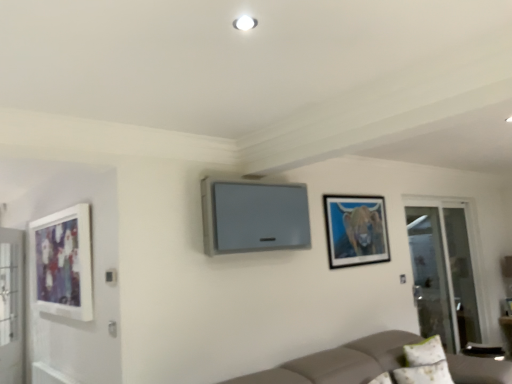
This screenshot has width=512, height=384. What do you see at coordinates (443, 273) in the screenshot?
I see `transparent glass screen door at right, the 1th screen door in the right-to-left sequence` at bounding box center [443, 273].

In the scene shown: Measure the distance between point (441,349) and camera.

The distance of point (441,349) from camera is 11.40 feet.

What do you see at coordinates (63, 263) in the screenshot? The width and height of the screenshot is (512, 384). I see `matte white picture frame at left, which is the 1th picture frame in left-to-right order` at bounding box center [63, 263].

Identify the location of matte white picture frame at left, the 2th picture frame when ordered from right to left. This screenshot has width=512, height=384. (63, 263).

The height and width of the screenshot is (384, 512). Describe the element at coordinates (11, 306) in the screenshot. I see `clear glass screen door at left, the first screen door viewed from the left` at that location.

Locate an element on the screen. matte black picture frame at upper right, marked as the first picture frame in a right-to-left arrangement is located at coordinates 356,230.

Looking at this image, is white fabric pillow at lower right bigger than matte black picture frame at upper right, which is the second picture frame in left-to-right order?

Yes, white fabric pillow at lower right is bigger than matte black picture frame at upper right, which is the second picture frame in left-to-right order.

Can matte black picture frame at upper right, marked as the first picture frame in a right-to-left arrangement, be found inside white fabric pillow at lower right?

No, white fabric pillow at lower right does not contain matte black picture frame at upper right, marked as the first picture frame in a right-to-left arrangement.

Is point (422, 368) closer or farther from the camera than point (360, 214)?

Point (422, 368) appears to be closer to the viewer than point (360, 214).

Measure the distance between white fabric pillow at lower right and matte black picture frame at upper right, which is the second picture frame in left-to-right order.

white fabric pillow at lower right and matte black picture frame at upper right, which is the second picture frame in left-to-right order, are 3.38 feet apart.

Is matte black picture frame at upper right, marked as the first picture frame in a right-to-left arrangement, inside or outside of transparent glass screen door at right, the 2th screen door from the front?

matte black picture frame at upper right, marked as the first picture frame in a right-to-left arrangement, is not enclosed by transparent glass screen door at right, the 2th screen door from the front.

Which is behind, matte black picture frame at upper right, which is the second picture frame in left-to-right order, or transparent glass screen door at right, the 2th screen door from the front?

transparent glass screen door at right, the 2th screen door from the front.

Based on the photo, based on their positions, is matte black picture frame at upper right, which is the second picture frame in left-to-right order, located to the left or right of transparent glass screen door at right, which is the second screen door from left to right?

matte black picture frame at upper right, which is the second picture frame in left-to-right order, is positioned on transparent glass screen door at right, which is the second screen door from left to right,'s left side.

How different are the orientations of matte black picture frame at upper right, which is the second picture frame in left-to-right order, and transparent glass screen door at right, which ranks as the 1th screen door in back-to-front order, in degrees?

The facing directions of matte black picture frame at upper right, which is the second picture frame in left-to-right order, and transparent glass screen door at right, which ranks as the 1th screen door in back-to-front order, are 0.517 degrees apart.

Is clear glass screen door at left, the second screen door positioned from the right, not close to transparent glass screen door at right, the 2th screen door from the front?

clear glass screen door at left, the second screen door positioned from the right, is positioned a significant distance from transparent glass screen door at right, the 2th screen door from the front.

Considering the sizes of clear glass screen door at left, which is the 2th screen door from back to front, and transparent glass screen door at right, the 2th screen door from the front, in the image, is clear glass screen door at left, which is the 2th screen door from back to front, bigger or smaller than transparent glass screen door at right, the 2th screen door from the front,?

Clearly, clear glass screen door at left, which is the 2th screen door from back to front, is smaller in size than transparent glass screen door at right, the 2th screen door from the front.

Considering the relative positions of clear glass screen door at left, which is the 2th screen door from back to front, and transparent glass screen door at right, which is the second screen door from left to right, in the image provided, is clear glass screen door at left, which is the 2th screen door from back to front, to the left of transparent glass screen door at right, which is the second screen door from left to right, from the viewer's perspective?

Yes, clear glass screen door at left, which is the 2th screen door from back to front, is to the left of transparent glass screen door at right, which is the second screen door from left to right.

Could you tell me if matte white picture frame at left, which is the 1th picture frame in left-to-right order, is turned towards transparent glass screen door at right, the 2th screen door from the front?

No, matte white picture frame at left, which is the 1th picture frame in left-to-right order, is not oriented towards transparent glass screen door at right, the 2th screen door from the front.

Is matte white picture frame at left, which is the 1th picture frame in left-to-right order, taller than transparent glass screen door at right, the 1th screen door in the right-to-left sequence?

No.

From the image's perspective, which is above, matte white picture frame at left, which is the 1th picture frame in left-to-right order, or transparent glass screen door at right, the 1th screen door in the right-to-left sequence?

matte white picture frame at left, which is the 1th picture frame in left-to-right order.

In the scene shown: How different are the orientations of matte white picture frame at left, which is the 1th picture frame in left-to-right order, and transparent glass screen door at right, which is the second screen door from left to right, in degrees?

matte white picture frame at left, which is the 1th picture frame in left-to-right order, and transparent glass screen door at right, which is the second screen door from left to right, are facing 90.6 degrees away from each other.

Is transparent glass screen door at right, the 2th screen door from the front, a part of white fabric pillow at lower right?

No.

Which of these two, white fabric pillow at lower right or transparent glass screen door at right, which is the second screen door from left to right, is thinner?

With smaller width is transparent glass screen door at right, which is the second screen door from left to right.

Does white fabric pillow at lower right have a greater height compared to transparent glass screen door at right, the 2th screen door from the front?

No, white fabric pillow at lower right is not taller than transparent glass screen door at right, the 2th screen door from the front.

Is matte white picture frame at left, which is the 1th picture frame in left-to-right order, a part of white fabric pillow at lower right?

No.

From the image's perspective, which is below, white fabric pillow at lower right or matte white picture frame at left, the 2th picture frame when ordered from right to left?

white fabric pillow at lower right, from the image's perspective.

Is white fabric pillow at lower right directly adjacent to matte white picture frame at left, which is the 1th picture frame in left-to-right order?

No.

Can you confirm if white fabric pillow at lower right is wider than matte white picture frame at left, the 2th picture frame when ordered from right to left?

Correct, the width of white fabric pillow at lower right exceeds that of matte white picture frame at left, the 2th picture frame when ordered from right to left.

Which is nearer, (362, 248) or (19, 245)?

The point (362, 248) is in front.

Is matte black picture frame at upper right, which is the second picture frame in left-to-right order, facing towards clear glass screen door at left, the second screen door positioned from the right?

No, matte black picture frame at upper right, which is the second picture frame in left-to-right order, is not aimed at clear glass screen door at left, the second screen door positioned from the right.

Is matte black picture frame at upper right, which is the second picture frame in left-to-right order, next to clear glass screen door at left, the first screen door viewed from the left?

No, matte black picture frame at upper right, which is the second picture frame in left-to-right order, is not next to clear glass screen door at left, the first screen door viewed from the left.

Can you tell me how much matte black picture frame at upper right, marked as the first picture frame in a right-to-left arrangement, and clear glass screen door at left, the second screen door positioned from the right, differ in facing direction?

The angle between the facing direction of matte black picture frame at upper right, marked as the first picture frame in a right-to-left arrangement, and the facing direction of clear glass screen door at left, the second screen door positioned from the right, is 123 degrees.

The image size is (512, 384). I want to click on picture frame behind the white fabric pillow at lower right, so click(356, 230).

There is a matte black picture frame at upper right, which is the second picture frame in left-to-right order. Where is `the 2nd screen door below it (from a real-world perspective)`? The width and height of the screenshot is (512, 384). the 2nd screen door below it (from a real-world perspective) is located at coordinates (443, 273).

Which object lies nearer to the anchor point clear glass screen door at left, which is the 2th screen door from back to front, transparent glass screen door at right, which ranks as the 1th screen door in back-to-front order, or matte black picture frame at upper right, which is the second picture frame in left-to-right order?

The object closer to clear glass screen door at left, which is the 2th screen door from back to front, is matte black picture frame at upper right, which is the second picture frame in left-to-right order.

Based on their spatial positions, is matte black picture frame at upper right, which is the second picture frame in left-to-right order, or clear glass screen door at left, the first screen door viewed from the front, further from white fabric pillow at lower right?

Among the two, clear glass screen door at left, the first screen door viewed from the front, is located further to white fabric pillow at lower right.

Considering their positions, is matte white picture frame at left, which is the 1th picture frame in left-to-right order, positioned further to matte black picture frame at upper right, marked as the first picture frame in a right-to-left arrangement, than transparent glass screen door at right, which ranks as the 1th screen door in back-to-front order?

matte white picture frame at left, which is the 1th picture frame in left-to-right order, is positioned further to the anchor matte black picture frame at upper right, marked as the first picture frame in a right-to-left arrangement.

When comparing their distances from clear glass screen door at left, which is the 2th screen door from back to front, does matte black picture frame at upper right, which is the second picture frame in left-to-right order, or transparent glass screen door at right, the 2th screen door from the front, seem further?

transparent glass screen door at right, the 2th screen door from the front, lies further to clear glass screen door at left, which is the 2th screen door from back to front, than the other object.

Based on their spatial positions, is white fabric pillow at lower right or transparent glass screen door at right, which ranks as the 1th screen door in back-to-front order, further from clear glass screen door at left, which is the 2th screen door from back to front?

Based on the image, transparent glass screen door at right, which ranks as the 1th screen door in back-to-front order, appears to be further to clear glass screen door at left, which is the 2th screen door from back to front.

Estimate the real-world distances between objects in this image. Which object is closer to matte black picture frame at upper right, marked as the first picture frame in a right-to-left arrangement, clear glass screen door at left, the second screen door positioned from the right, or matte white picture frame at left, the 2th picture frame when ordered from right to left?

matte white picture frame at left, the 2th picture frame when ordered from right to left, lies closer to matte black picture frame at upper right, marked as the first picture frame in a right-to-left arrangement, than the other object.

Considering their positions, is matte white picture frame at left, the 2th picture frame when ordered from right to left, positioned further to matte black picture frame at upper right, marked as the first picture frame in a right-to-left arrangement, than white fabric pillow at lower right?

matte white picture frame at left, the 2th picture frame when ordered from right to left, is further to matte black picture frame at upper right, marked as the first picture frame in a right-to-left arrangement.

Estimate the real-world distances between objects in this image. Which object is further from transparent glass screen door at right, the 1th screen door in the right-to-left sequence, clear glass screen door at left, the first screen door viewed from the front, or matte white picture frame at left, the 2th picture frame when ordered from right to left?

clear glass screen door at left, the first screen door viewed from the front.

Locate an element on the screen. picture frame situated between clear glass screen door at left, which is the 2th screen door from back to front, and matte black picture frame at upper right, which is the second picture frame in left-to-right order, from left to right is located at coordinates (63, 263).

Where is `picture frame located between matte white picture frame at left, the 2th picture frame when ordered from right to left, and transparent glass screen door at right, which ranks as the 1th screen door in back-to-front order, in the left-right direction`? picture frame located between matte white picture frame at left, the 2th picture frame when ordered from right to left, and transparent glass screen door at right, which ranks as the 1th screen door in back-to-front order, in the left-right direction is located at coordinates (356, 230).

Identify the location of pillow between matte white picture frame at left, which is the 1th picture frame in left-to-right order, and transparent glass screen door at right, which ranks as the 1th screen door in back-to-front order, from left to right. (424, 364).

The image size is (512, 384). Find the location of `picture frame located between matte white picture frame at left, the 2th picture frame when ordered from right to left, and white fabric pillow at lower right in the left-right direction`. picture frame located between matte white picture frame at left, the 2th picture frame when ordered from right to left, and white fabric pillow at lower right in the left-right direction is located at coordinates (356, 230).